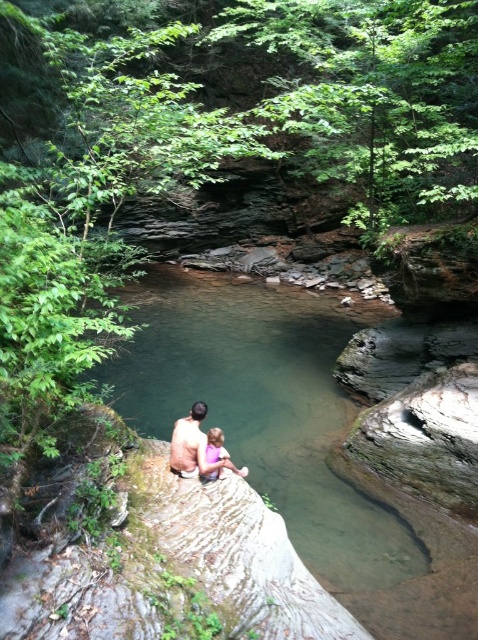
You are a photographer trying to capture a photo of the clear water at center and the smooth skin man at center. Based on their positions, which object is located to the right of the other?

The clear water at center is positioned on the right side of smooth skin man at center, so the clear water at center is to the right of the smooth skin man at center.

You are a photographer trying to capture a photo of the clear water at center and the pink fabric at center. Based on their positions, which object should you adjust your camera to focus on first if you want to ensure both are in frame?

The pink fabric at center is on the left side of the clear water at center, so you should focus on the pink fabric at center first to ensure both are in frame.

In the scene shown: You are standing at the edge of the pool and want to place a floating toy into the water. The pink fabric at center is part of a childswim suit. Will the floating toy land in the water if you aim it towards the clear water at center?

The clear water at center is above the pink fabric at center, so aiming towards the clear water at center will place the floating toy into the water above the pink fabric at center.